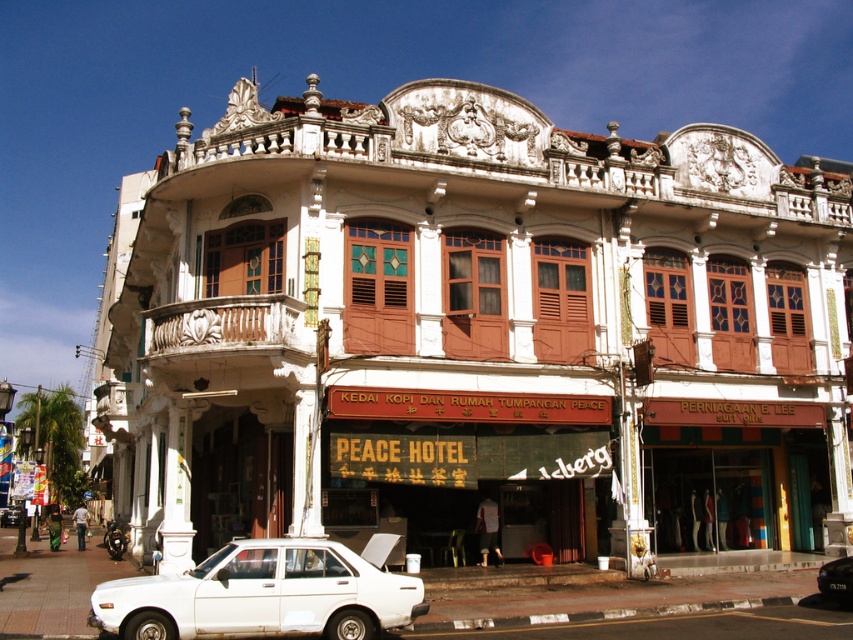
Question: Does white matte car at lower center appear under white matte car at center?

Choices:
 (A) no
 (B) yes

Answer: (A)

Question: Which of the following is the closest to the observer?

Choices:
 (A) (633, 472)
 (B) (19, 520)
 (C) (315, 554)
 (D) (839, 579)

Answer: (C)

Question: Observing the image, what is the correct spatial positioning of white textured building at center in reference to white matte car at center?

Choices:
 (A) right
 (B) left

Answer: (A)

Question: Does white matte car at lower center appear under white matte sedan at center?

Choices:
 (A) no
 (B) yes

Answer: (A)

Question: Among these objects, which one is farthest from the camera?

Choices:
 (A) white matte car at center
 (B) white matte car at lower center
 (C) white textured building at center
 (D) white matte sedan at center

Answer: (A)

Question: Which point is closer to the camera taking this photo?

Choices:
 (A) (727, 164)
 (B) (144, 589)
 (C) (15, 509)

Answer: (B)